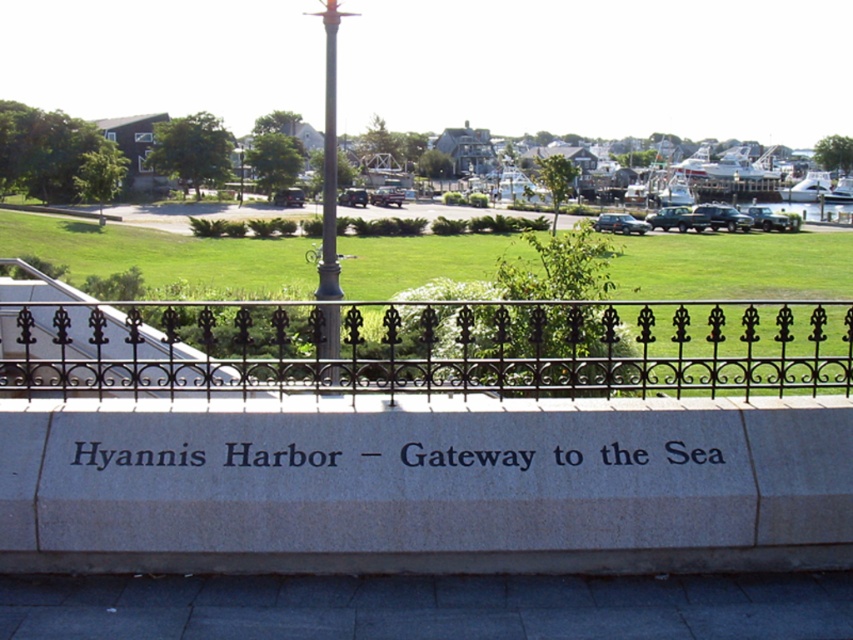
Which is above, black stone sign at center or polished metal pole at center?

Positioned higher is polished metal pole at center.

Is point (693, 449) in front of point (334, 182)?

That is True.

Measure the distance between point (523, 451) and camera.

They are 5.28 meters apart.

The height and width of the screenshot is (640, 853). Find the location of `black stone sign at center`. black stone sign at center is located at coordinates (135, 456).

Consider the image. Is black wrought iron fence at center smaller than polished metal pole at center?

Yes.

Is black wrought iron fence at center to the right of polished metal pole at center from the viewer's perspective?

Correct, you'll find black wrought iron fence at center to the right of polished metal pole at center.

Is point (206, 348) more distant than point (321, 280)?

Yes, it is behind point (321, 280).

Image resolution: width=853 pixels, height=640 pixels. I want to click on black wrought iron fence at center, so click(427, 348).

Does dark gray concrete pavement at lower center appear under polished metal pole at center?

Indeed, dark gray concrete pavement at lower center is positioned under polished metal pole at center.

The image size is (853, 640). What do you see at coordinates (427, 605) in the screenshot?
I see `dark gray concrete pavement at lower center` at bounding box center [427, 605].

Where is `dark gray concrete pavement at lower center`? The height and width of the screenshot is (640, 853). dark gray concrete pavement at lower center is located at coordinates (427, 605).

You are a GUI agent. You are given a task and a screenshot of the screen. Output one action in this format:
    pyautogui.click(x=<x>, y=<y>)
    Task: Click on the dark gray concrete pavement at lower center
    
    Given the screenshot: What is the action you would take?
    pyautogui.click(x=427, y=605)